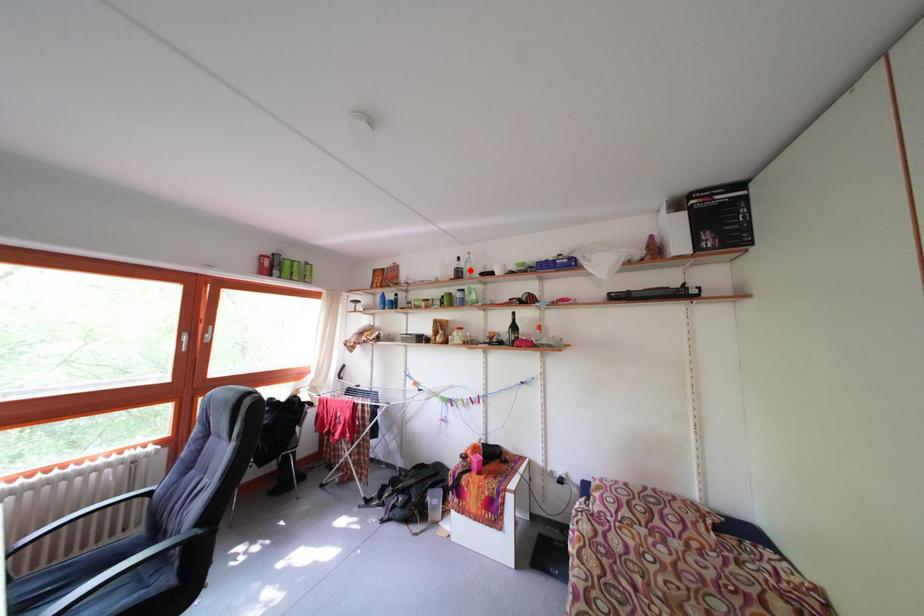
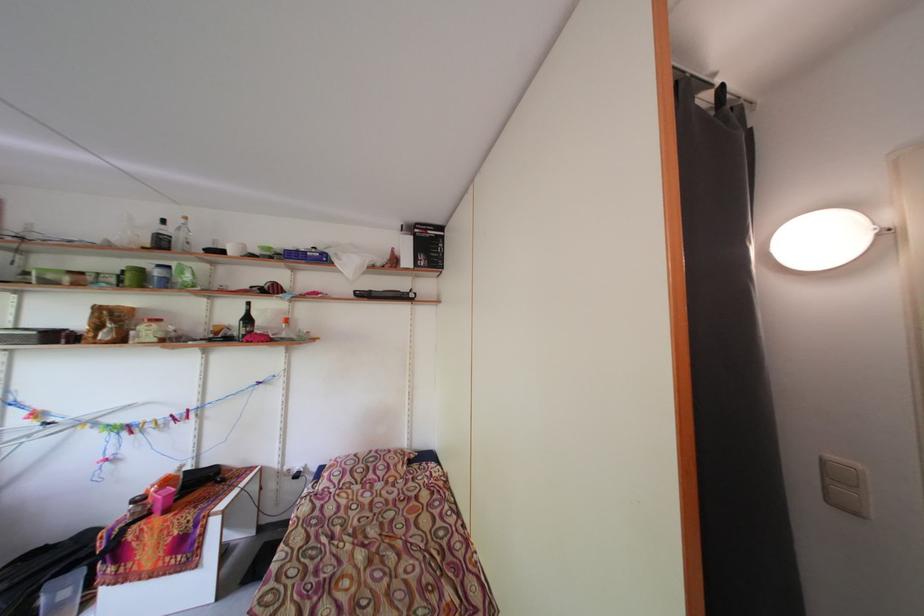
Find the pixel in the second image that matches the highlighted location in the first image.

(176, 236)